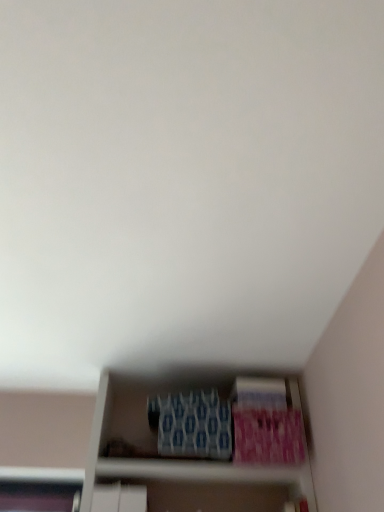
Question: Considering the relative positions of pink matte paperback book at lower right, which appears as the first paperback book when viewed from the right, and blue textured paperback book at lower center, the second paperback book in the right-to-left sequence, in the image provided, is pink matte paperback book at lower right, which appears as the first paperback book when viewed from the right, to the left of blue textured paperback book at lower center, the second paperback book in the right-to-left sequence, from the viewer's perspective?

Choices:
 (A) no
 (B) yes

Answer: (A)

Question: Does pink matte paperback book at lower right, which is the 3th paperback book in left-to-right order, have a smaller size compared to blue textured paperback book at lower center, the second paperback book in the right-to-left sequence?

Choices:
 (A) no
 (B) yes

Answer: (A)

Question: From a real-world perspective, does pink matte paperback book at lower right, which is the 3th paperback book in left-to-right order, stand above blue textured paperback book at lower center, the second paperback book in the right-to-left sequence?

Choices:
 (A) no
 (B) yes

Answer: (A)

Question: From a real-world perspective, is pink matte paperback book at lower right, which is the 3th paperback book in left-to-right order, below blue textured paperback book at lower center, the second paperback book viewed from the left?

Choices:
 (A) no
 (B) yes

Answer: (B)

Question: Does pink matte paperback book at lower right, which is the 3th paperback book in left-to-right order, appear on the right side of blue textured paperback book at lower center, the second paperback book viewed from the left?

Choices:
 (A) no
 (B) yes

Answer: (B)

Question: Considering the positions of blue textured paperback book at lower center, the second paperback book viewed from the left, and blue textured paperback book at center, the 3th paperback book in the right-to-left sequence, in the image, is blue textured paperback book at lower center, the second paperback book viewed from the left, wider or thinner than blue textured paperback book at center, the 3th paperback book in the right-to-left sequence,?

Choices:
 (A) wide
 (B) thin

Answer: (B)

Question: Would you say blue textured paperback book at lower center, the second paperback book in the right-to-left sequence, is to the left or to the right of blue textured paperback book at center, the 1th paperback book in the left-to-right sequence, in the picture?

Choices:
 (A) right
 (B) left

Answer: (A)

Question: In terms of size, does blue textured paperback book at lower center, the second paperback book viewed from the left, appear bigger or smaller than blue textured paperback book at center, the 3th paperback book in the right-to-left sequence?

Choices:
 (A) big
 (B) small

Answer: (B)

Question: From the image's perspective, is blue textured paperback book at lower center, the second paperback book viewed from the left, positioned above or below blue textured paperback book at center, the 1th paperback book in the left-to-right sequence?

Choices:
 (A) below
 (B) above

Answer: (B)

Question: Considering the positions of blue textured paperback book at center, the 1th paperback book in the left-to-right sequence, and blue textured paperback book at lower center, the second paperback book in the right-to-left sequence, in the image, is blue textured paperback book at center, the 1th paperback book in the left-to-right sequence, wider or thinner than blue textured paperback book at lower center, the second paperback book in the right-to-left sequence,?

Choices:
 (A) thin
 (B) wide

Answer: (B)

Question: In terms of height, does blue textured paperback book at center, the 3th paperback book in the right-to-left sequence, look taller or shorter compared to blue textured paperback book at lower center, the second paperback book viewed from the left?

Choices:
 (A) tall
 (B) short

Answer: (A)

Question: Is blue textured paperback book at center, the 1th paperback book in the left-to-right sequence, spatially inside blue textured paperback book at lower center, the second paperback book viewed from the left, or outside of it?

Choices:
 (A) inside
 (B) outside

Answer: (B)

Question: Considering the positions of point (203, 424) and point (276, 398), is point (203, 424) closer or farther from the camera than point (276, 398)?

Choices:
 (A) closer
 (B) farther

Answer: (A)

Question: From their relative heights in the image, would you say pink matte paperback book at lower right, which appears as the first paperback book when viewed from the right, is taller or shorter than blue textured paperback book at lower center, the second paperback book in the right-to-left sequence?

Choices:
 (A) short
 (B) tall

Answer: (B)

Question: Would you say pink matte paperback book at lower right, which is the 3th paperback book in left-to-right order, is to the left or to the right of blue textured paperback book at lower center, the second paperback book viewed from the left, in the picture?

Choices:
 (A) left
 (B) right

Answer: (B)